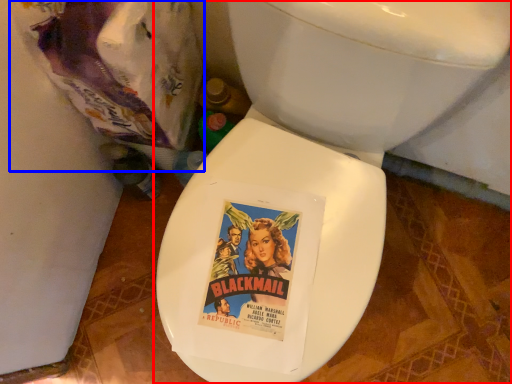
Question: Which object appears farthest to the camera in this image, toilet (highlighted by a red box) or garbage (highlighted by a blue box)?

Choices:
 (A) toilet
 (B) garbage

Answer: (B)